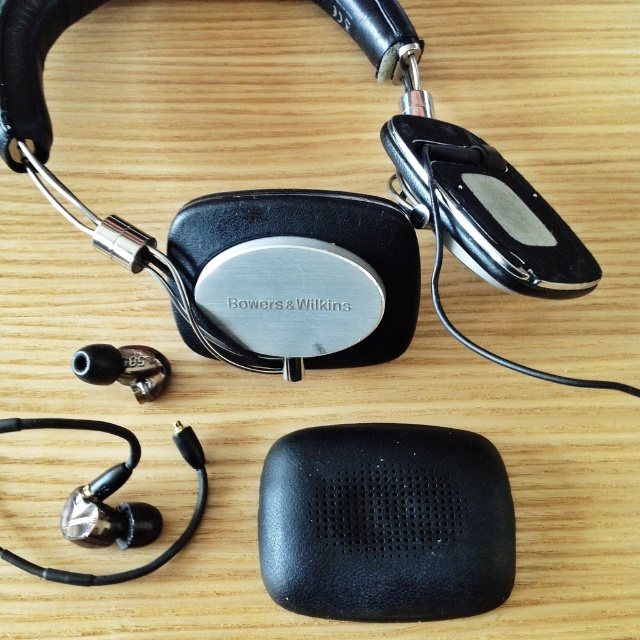
Consider the image. You are a photographer setting up a product shoot. You need to position a light source so that it illuminates the black matte speaker at center and the metallic silver earphone at lower left equally. Given their positions relative to the camera, which object should you place the light closer to to achieve even lighting?

The black matte speaker at center is closer to the viewer than the metallic silver earphone at lower left. To achieve even lighting, the light source should be placed closer to the metallic silver earphone at lower left since it is farther away and requires more light to appear equally illuminated.

You are setting up a portable audio system and need to place the black matte speaker at center and the metallic silver earphone at lower left on a shelf. The shelf has a height limit of 10 cm. Can both items fit vertically without exceeding the height limit?

The black matte speaker at center is taller than the metallic silver earphone at lower left. However, the exact heights are not provided, so it is uncertain if the speaker alone fits within the 10 cm height limit. Without specific measurements, we cannot confirm if both items will fit vertically on the shelf.

You are setting up a music system and need to place the black matte speaker at center and the metallic silver earphone at lower left. According to the image, where should you position the black matte speaker relative to the metallic silver earphone?

The black matte speaker at center should be positioned below the metallic silver earphone at lower left as per the image.